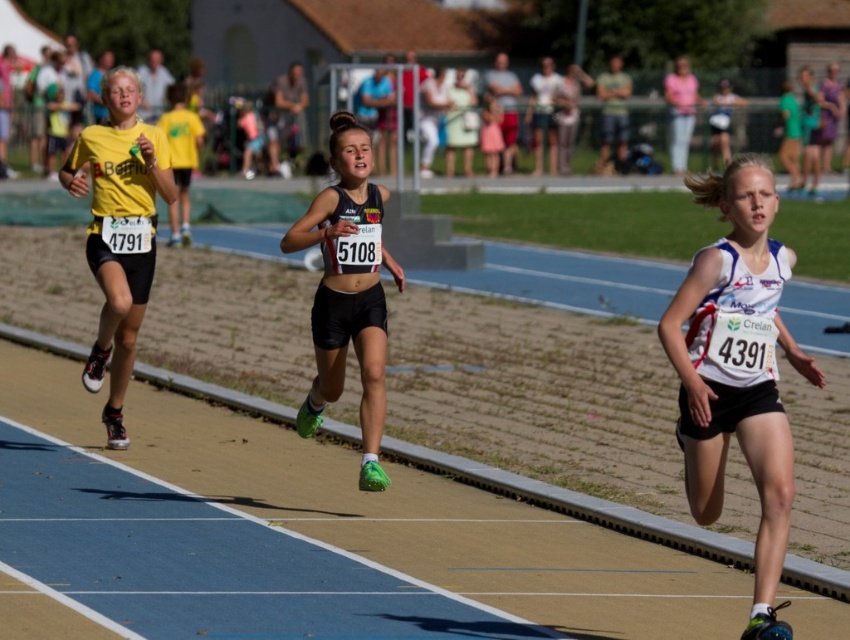
Question: Which of the following is the closest to the observer?

Choices:
 (A) matte black shorts at center
 (B) yellow matte running suit at left

Answer: (A)

Question: Which of the following is the farthest from the observer?

Choices:
 (A) yellow matte running suit at left
 (B) matte black shorts at center

Answer: (A)

Question: Considering the relative positions of white fabric tank top at center and yellow matte running suit at left in the image provided, where is white fabric tank top at center located with respect to yellow matte running suit at left?

Choices:
 (A) above
 (B) below

Answer: (B)

Question: Does white fabric tank top at center appear on the right side of yellow matte running suit at left?

Choices:
 (A) yes
 (B) no

Answer: (A)

Question: Does white fabric tank top at center have a smaller size compared to yellow matte running suit at left?

Choices:
 (A) yes
 (B) no

Answer: (B)

Question: Which is nearer to the yellow matte running suit at left?

Choices:
 (A) matte black shorts at center
 (B) white fabric tank top at center

Answer: (A)